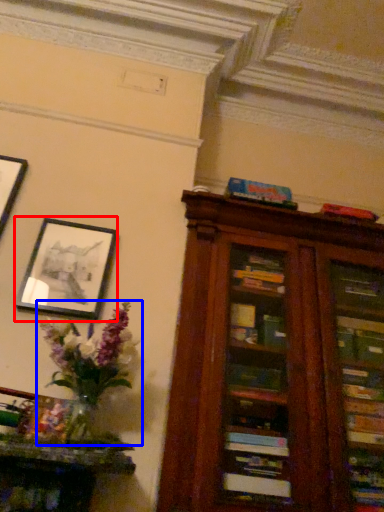
Question: Which of the following is the farthest to the observer, picture frame (highlighted by a red box) or floral arrangement (highlighted by a blue box)?

Choices:
 (A) picture frame
 (B) floral arrangement

Answer: (A)